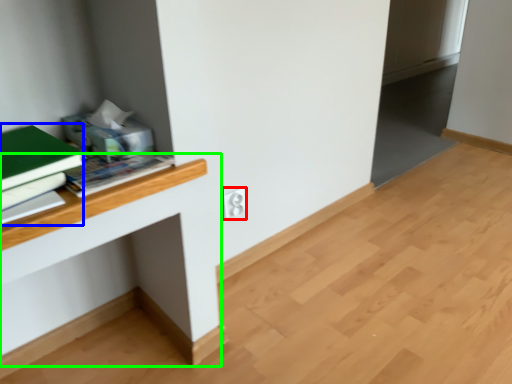
Question: Which object is the farthest from electric outlet (highlighted by a red box)? Choose among these: paperback book (highlighted by a blue box) or computer desk (highlighted by a green box).

Choices:
 (A) paperback book
 (B) computer desk

Answer: (A)